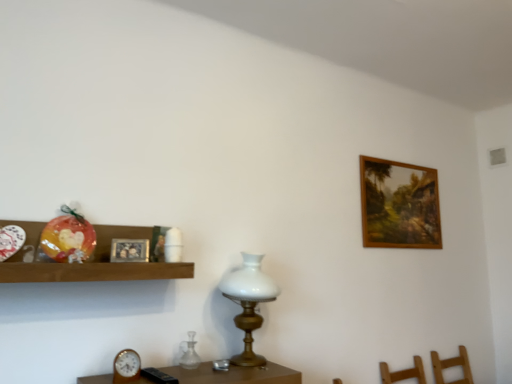
Question: Does transparent glass vase at center have a smaller size compared to wooden clock at lower left?

Choices:
 (A) yes
 (B) no

Answer: (B)

Question: Is wooden clock at lower left at the back of transparent glass vase at center?

Choices:
 (A) no
 (B) yes

Answer: (A)

Question: Is transparent glass vase at center next to wooden clock at lower left?

Choices:
 (A) no
 (B) yes

Answer: (A)

Question: Is transparent glass vase at center at the right side of wooden clock at lower left?

Choices:
 (A) yes
 (B) no

Answer: (A)

Question: Does transparent glass vase at center have a greater height compared to wooden clock at lower left?

Choices:
 (A) no
 (B) yes

Answer: (B)

Question: Do you think white glass table lamp at center is within silver metallic picture frame at upper left, the second picture frame from the back, or outside of it?

Choices:
 (A) outside
 (B) inside

Answer: (A)

Question: From the image's perspective, relative to silver metallic picture frame at upper left, the second picture frame from the back, is white glass table lamp at center above or below?

Choices:
 (A) above
 (B) below

Answer: (B)

Question: Considering the positions of white glass table lamp at center and silver metallic picture frame at upper left, placed as the 1th picture frame when sorted from front to back, in the image, is white glass table lamp at center bigger or smaller than silver metallic picture frame at upper left, placed as the 1th picture frame when sorted from front to back,?

Choices:
 (A) small
 (B) big

Answer: (B)

Question: Is white glass table lamp at center to the left or to the right of silver metallic picture frame at upper left, the second picture frame viewed from the right, in the image?

Choices:
 (A) right
 (B) left

Answer: (A)

Question: Considering their positions, is silver metallic picture frame at upper left, acting as the first picture frame starting from the left, located in front of or behind wooden shelf at left?

Choices:
 (A) front
 (B) behind

Answer: (B)

Question: From a real-world perspective, is silver metallic picture frame at upper left, the second picture frame viewed from the right, positioned above or below wooden shelf at left?

Choices:
 (A) below
 (B) above

Answer: (B)

Question: From the image's perspective, relative to wooden shelf at left, is silver metallic picture frame at upper left, the second picture frame viewed from the right, above or below?

Choices:
 (A) below
 (B) above

Answer: (A)

Question: Does point (143, 254) appear closer or farther from the camera than point (141, 226)?

Choices:
 (A) closer
 (B) farther

Answer: (A)

Question: In terms of width, does wooden framed painting at upper right, the 1th picture frame viewed from the right, look wider or thinner when compared to white glass table lamp at center?

Choices:
 (A) wide
 (B) thin

Answer: (B)

Question: From the image's perspective, relative to white glass table lamp at center, is wooden framed painting at upper right, the second picture frame in the left-to-right sequence, above or below?

Choices:
 (A) below
 (B) above

Answer: (B)